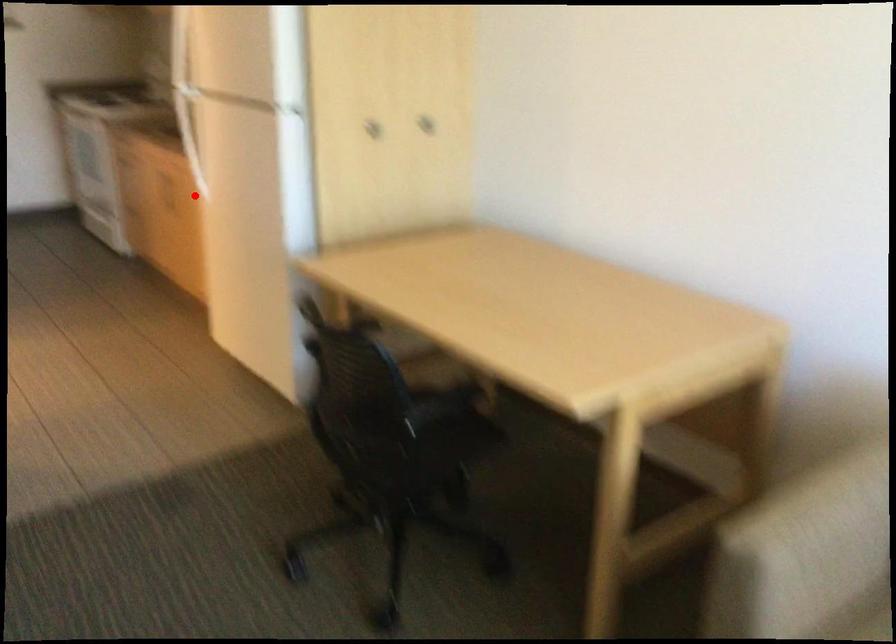
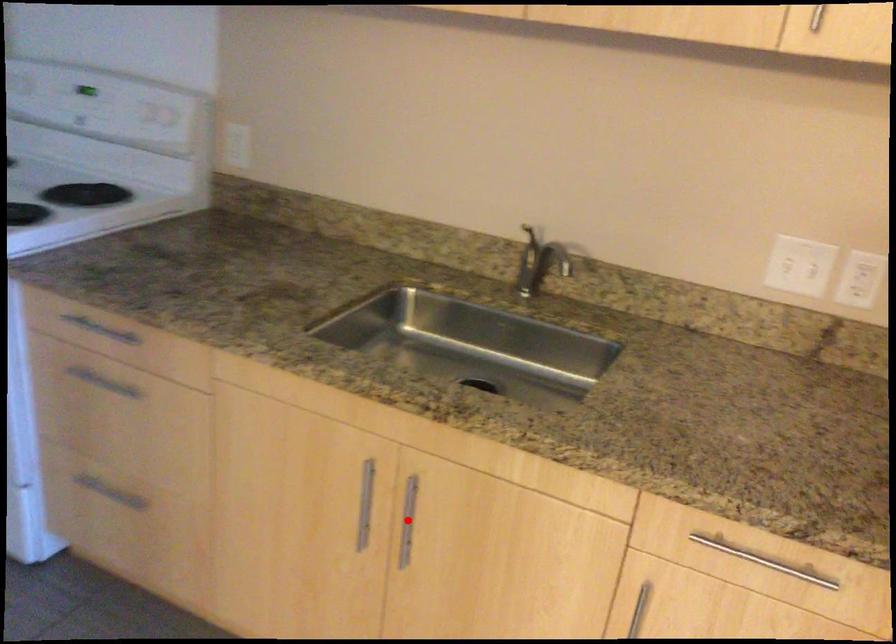
I am providing you with two images of the same scene from different viewpoints. A red point is marked on the first image and another point is marked on the second image. Is the marked point in image1 the same physical position as the marked point in image2?

Yes